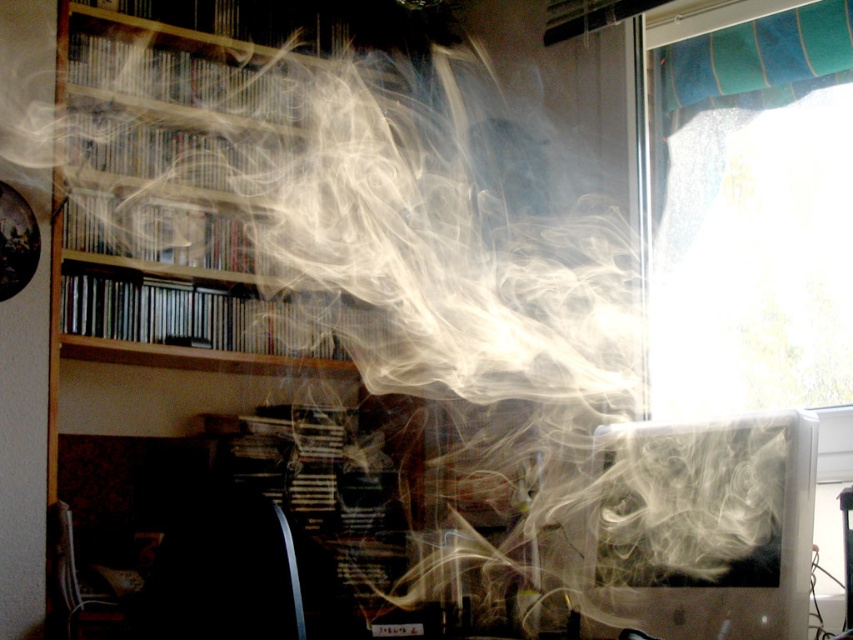
You are an interior designer assessing the lighting in this home office. You need to determine if the transparent glass window at upper right can provide sufficient natural light to the white glossy computer monitor at lower right. Based on their sizes, which one is bigger and might allow more light?

The transparent glass window at upper right is larger in size than the white glossy computer monitor at lower right, so it can provide more natural light to the monitor.

You are a delivery person who needs to place a large package on the desk in the home office. The package is 2 meters tall. Considering the transparent glass window at upper right and the white glossy computer monitor at lower right, which object would you have to avoid hitting with the package to prevent damage?

The transparent glass window at upper right is taller than the white glossy computer monitor at lower right, so you should avoid hitting the transparent glass window at upper right with the package to prevent damage since it is taller and more likely to be in the path.